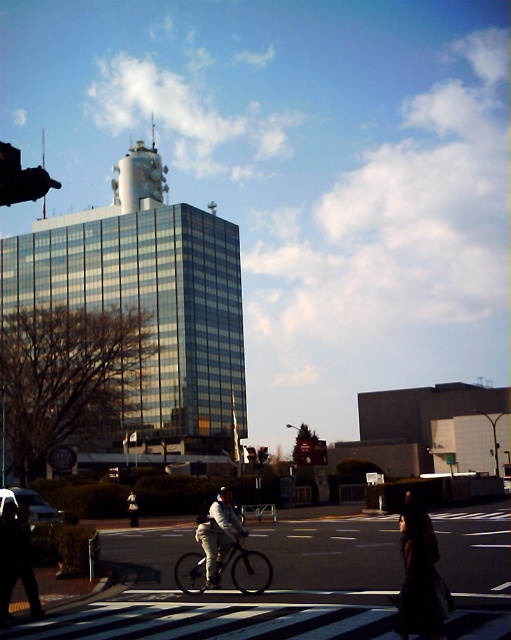
You are standing at the pedestrian crossing and want to determine which of the two points, point (220, 563) or point (127, 502), is closer to you. Based on the scene, which point is nearer?

Point (220, 563) is closer to the viewer than point (127, 502).